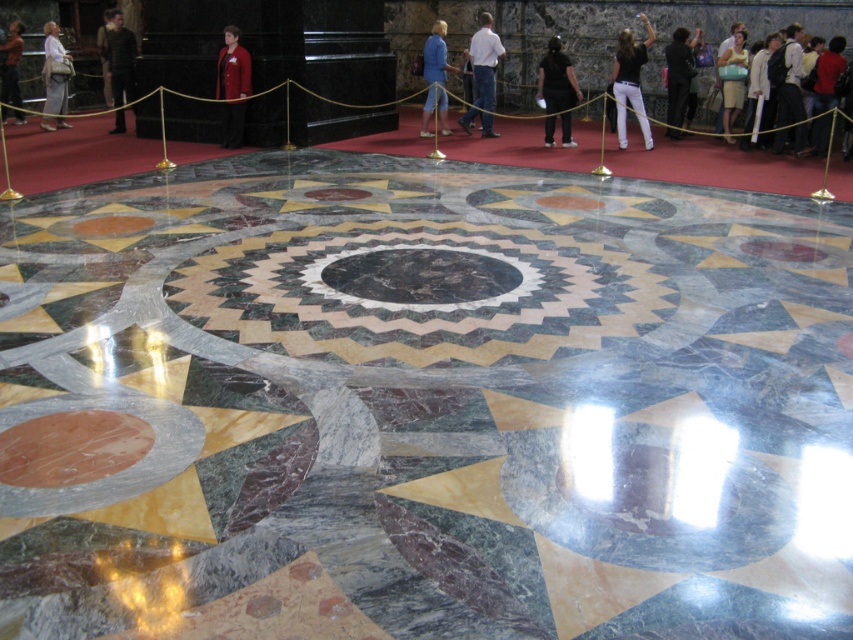
You are a photographer trying to capture the intricate marble floor patterns. You notice the light beige cotton dress at center and the matte black jacket at upper left in your shot. Which object takes up more space in the frame?

The matte black jacket at upper left takes up more space in the frame than the light beige cotton dress at center.

You are a security guard observing the scene. You notice a dark gray suit at upper left and a matte gray backpack at left. Which object is bigger in size?

The dark gray suit at upper left is larger in size than the matte gray backpack at left.